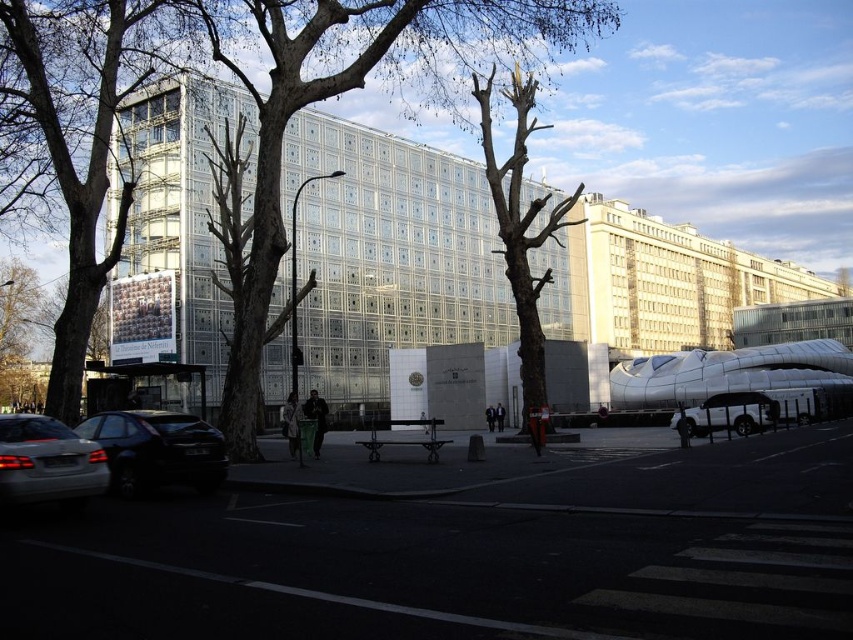
You are standing at the point marked by the coordinates point (86, 134) in the image. What object is located at this point?

The point (86, 134) corresponds to the green leafless tree at left.

You are a pedestrian standing on the sidewalk in front of the large building. You see a brown bark tree at center and a satin silver suv at right. Which object is closer to the large building?

The brown bark tree at center is closer to the large building because it is positioned to the left of the satin silver suv at right, which is further away from the building.

You are standing at the point with coordinates (256, 115) in the image. What object are you at?

You are at the brown bark tree at center, as the point with coordinates (256, 115) represents this object.